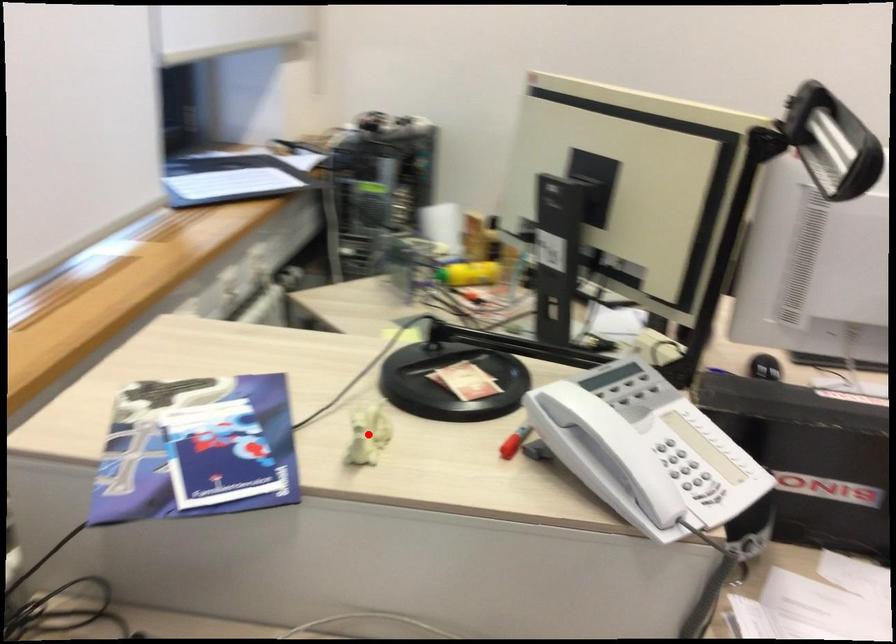
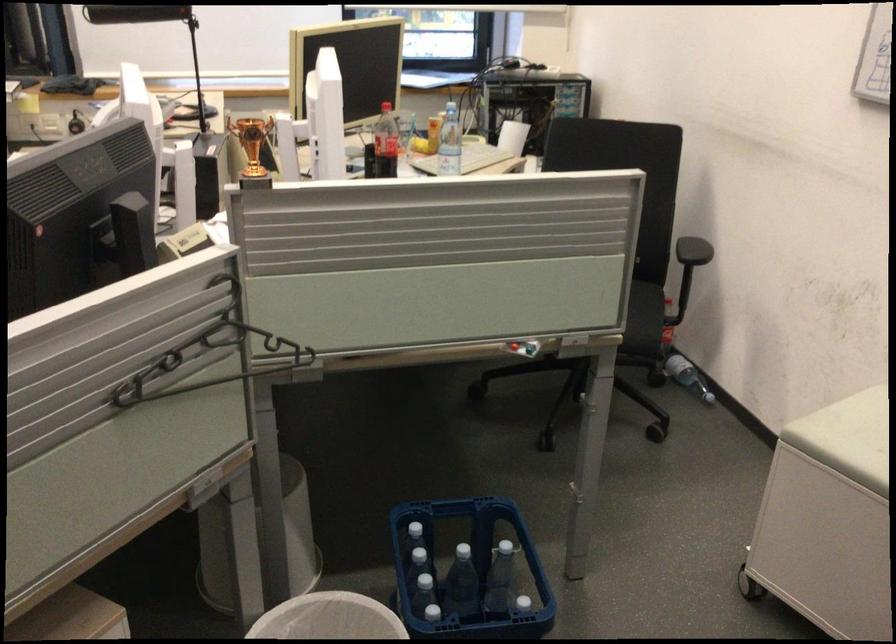
Question: I am providing you with two images of the same scene from different viewpoints. A red point is marked on the first image. Is the red point's position out of view in image 2?

Choices:
 (A) Yes
 (B) No

Answer: (A)